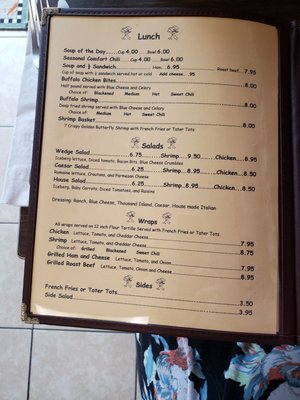
Locate an element on the screen. tile is located at coordinates (69, 358), (16, 369), (10, 287).